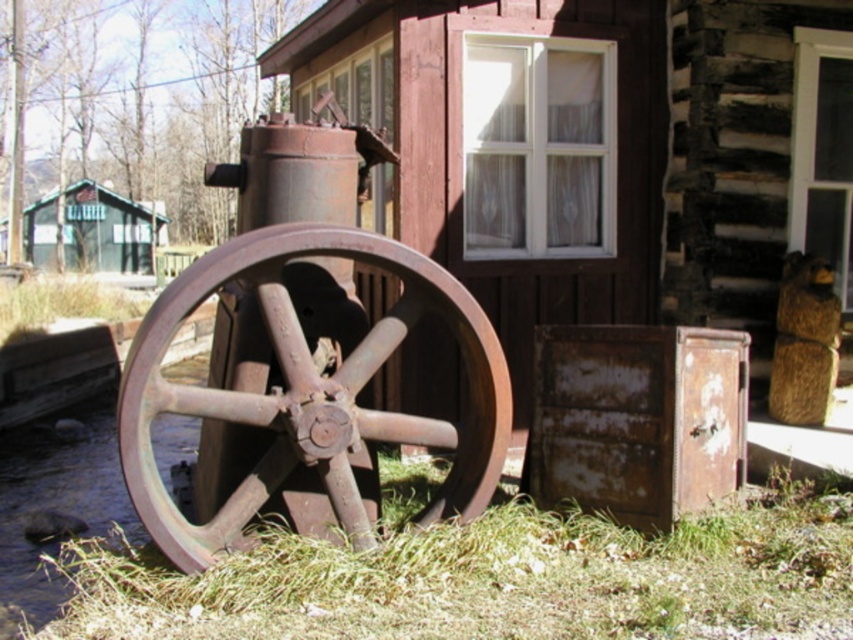
In the scene shown: You are standing in the scene and want to walk towards the green wood cabin at left. Which direction should you move relative to the green grass at lower center?

You should move away from the green grass at lower center because the green wood cabin at left is further away from the viewer, meaning you need to move in the opposite direction of the grass to reach it.

Consider the image. You are standing in the rustic outdoor scene and want to walk from the green wood cabin at left to the green grass at lower center. In which direction should you head?

You should head to the right to reach the green grass at lower center from the green wood cabin at left because the green grass at lower center is located to the right of the green wood cabin at left.